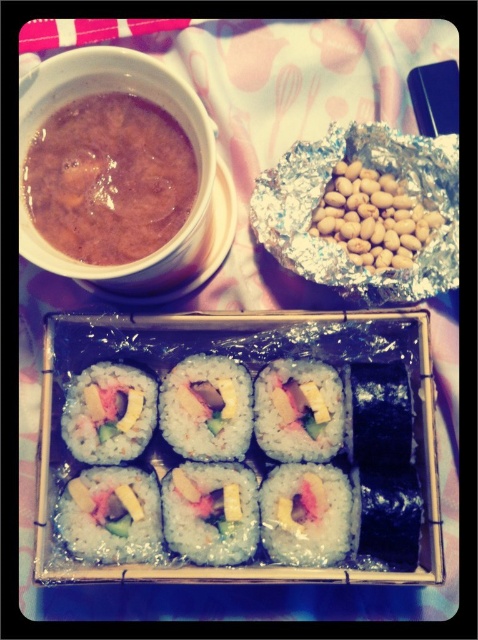
Question: Does shiny white rice roll at center have a lesser width compared to white rice roll at center?

Choices:
 (A) no
 (B) yes

Answer: (A)

Question: Among these points, which one is farthest from the camera?

Choices:
 (A) (207, 497)
 (B) (239, 385)
 (C) (173, 154)
 (D) (323, 419)

Answer: (B)

Question: Estimate the real-world distances between objects in this image. Which object is closer to the brown matte soup at upper left?

Choices:
 (A) white rice roll at center
 (B) sushi at center

Answer: (B)

Question: Which of the following is the farthest from the observer?

Choices:
 (A) brown matte soup at upper left
 (B) white rice roll at center
 (C) sushi at center

Answer: (B)

Question: Is sushi at center smaller than white rice roll at center?

Choices:
 (A) yes
 (B) no

Answer: (B)

Question: In this image, where is sushi at center located relative to white rice roll at center?

Choices:
 (A) above
 (B) below

Answer: (B)